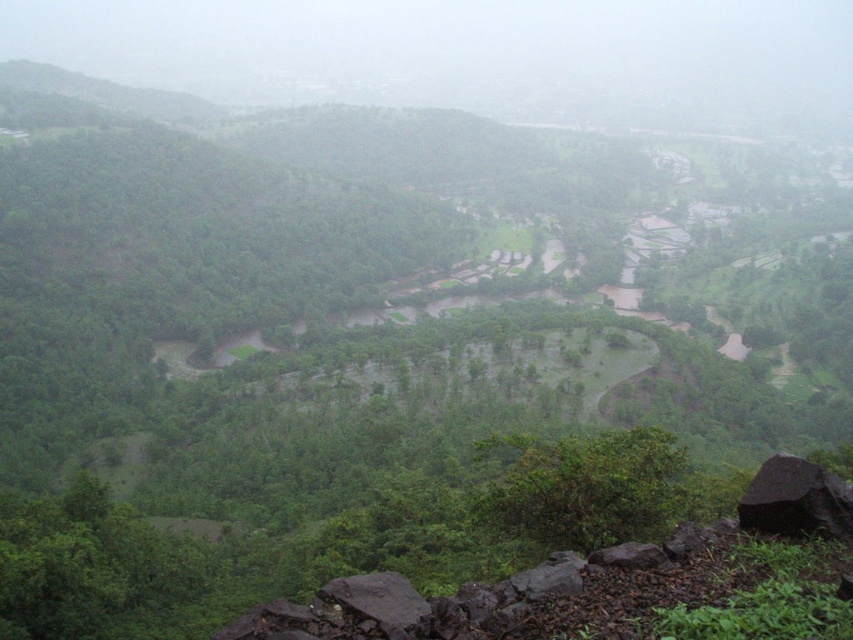
Does black rock at lower right appear on the left side of dark gray rock at lower center?

Incorrect, black rock at lower right is not on the left side of dark gray rock at lower center.

Between point (811, 465) and point (398, 609), which one is positioned in front?

Positioned in front is point (398, 609).

Does point (753, 513) come farther from viewer compared to point (374, 589)?

Yes, point (753, 513) is farther from viewer.

The image size is (853, 640). What are the coordinates of `black rock at lower right` in the screenshot? It's located at (795, 499).